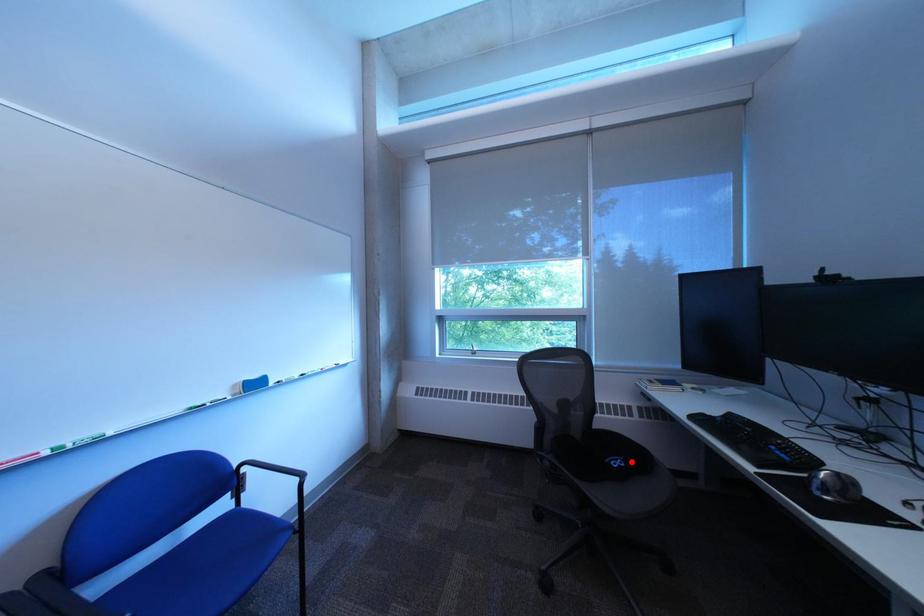
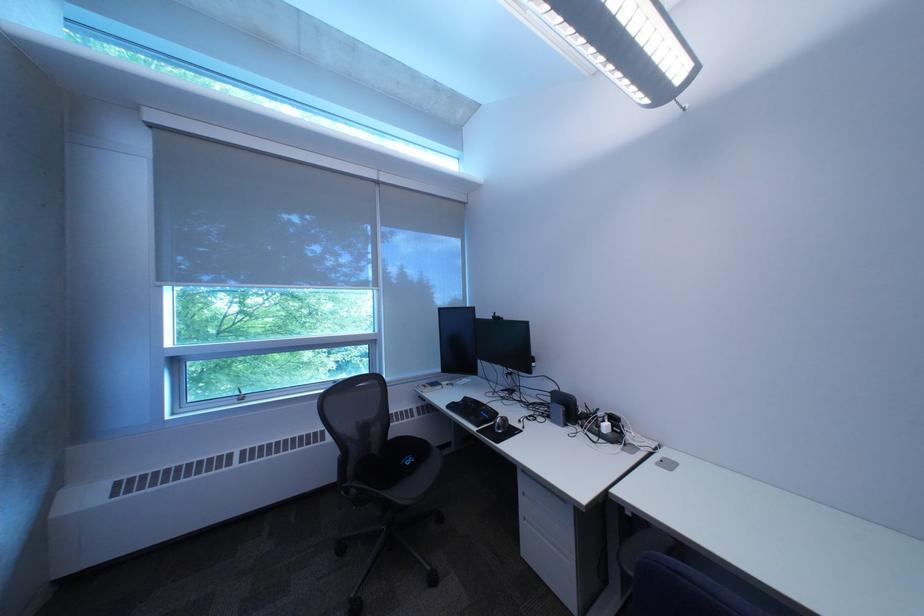
The point at the highlighted location is marked in the first image. Where is the corresponding point in the second image?

(423, 461)